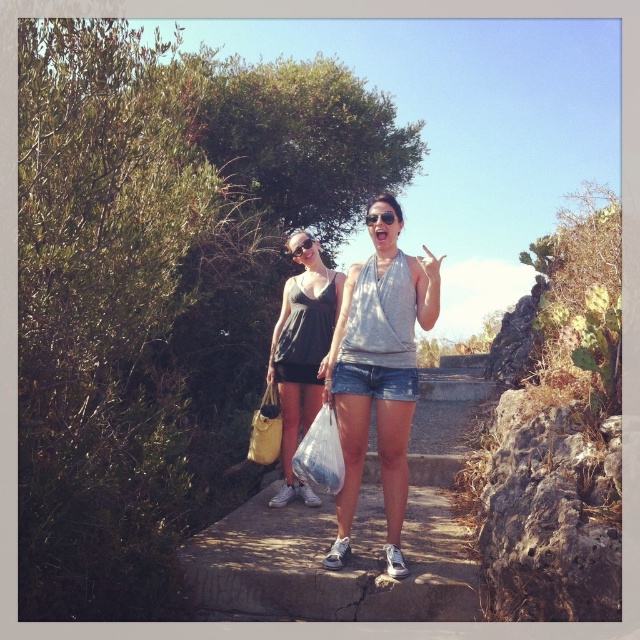
Which is more to the left, gray cotton tank top at center or matte black dress at center?

Positioned to the left is matte black dress at center.

Consider the image. Can you confirm if gray cotton tank top at center is positioned to the right of matte black dress at center?

Yes, gray cotton tank top at center is to the right of matte black dress at center.

Who is more distant from viewer, (426, 316) or (298, 422)?

Positioned behind is point (298, 422).

The height and width of the screenshot is (640, 640). Find the location of `gray cotton tank top at center`. gray cotton tank top at center is located at coordinates (x=378, y=378).

Who is positioned more to the left, concrete stairs at center or gray cotton tank top at center?

Answer: gray cotton tank top at center is more to the left.

Is point (328, 502) more distant than point (364, 448)?

Yes, it is.

Identify the location of concrete stairs at center. (353, 534).

Does matte black dress at center appear over translucent plastic bag at center?

Yes, matte black dress at center is above translucent plastic bag at center.

Between matte black dress at center and translucent plastic bag at center, which one appears on the left side from the viewer's perspective?

Positioned to the left is matte black dress at center.

Find the location of a particular element. Image resolution: width=640 pixels, height=640 pixels. matte black dress at center is located at coordinates (301, 353).